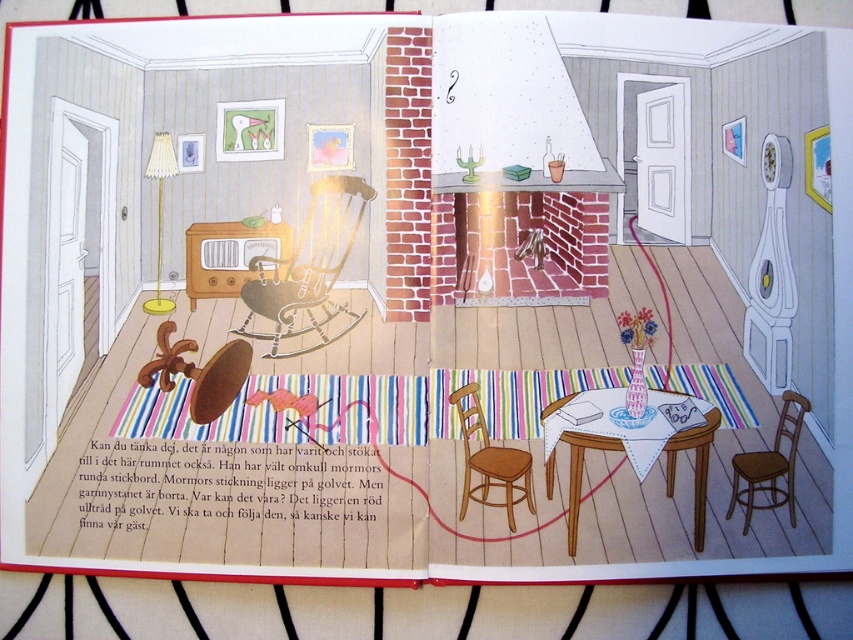
You are standing in the living room and want to move from the point marked at coordinates point (695, 528) to the dining area. There is an obstacle at point (575, 404). Will you pass in front of or behind the obstacle?

Since point (695, 528) is in front of point (575, 404), you will pass behind the obstacle at point (575, 404) when moving towards the dining area.